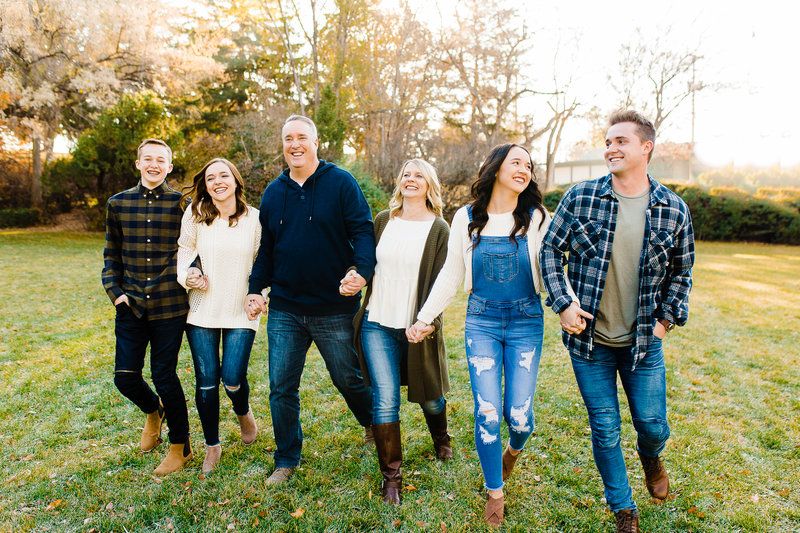
Locate an element on the screen. family picture is located at coordinates (132, 259), (237, 250), (324, 244), (512, 290), (626, 282).